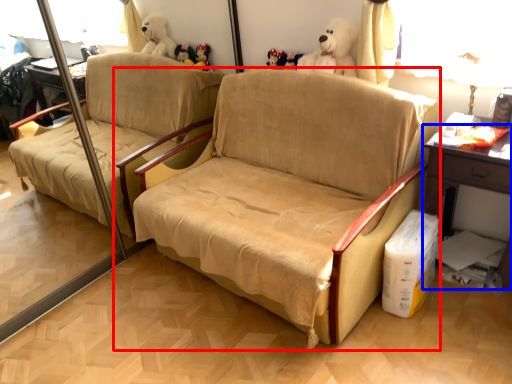
Question: Which point is further to the camera, studio couch (highlighted by a red box) or table (highlighted by a blue box)?

Choices:
 (A) studio couch
 (B) table

Answer: (B)